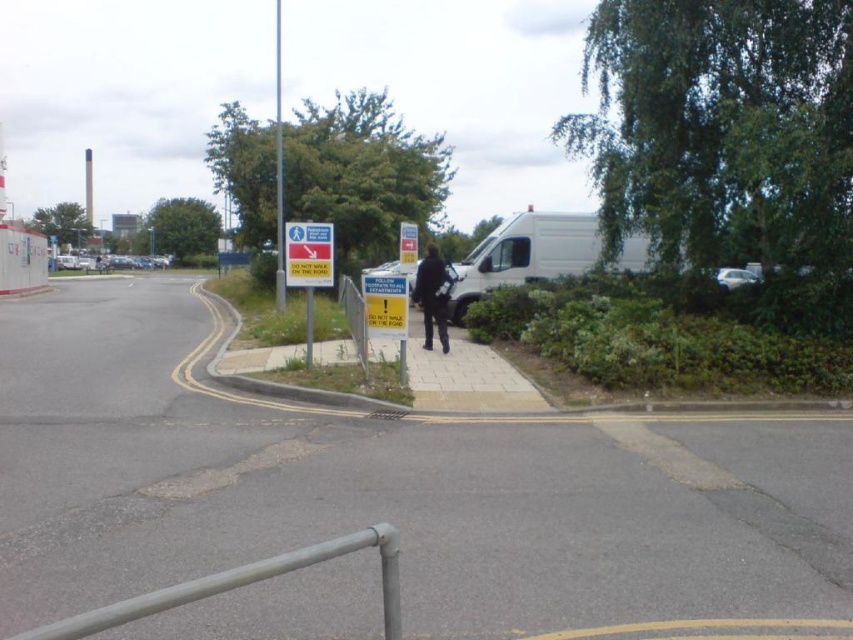
Question: Considering the real-world distances, which object is farthest from the dark blue jacket at center?

Choices:
 (A) metallic silver car at right
 (B) yellow plastic sign at center

Answer: (A)

Question: Among these objects, which one is farthest from the camera?

Choices:
 (A) yellow plastic sign at center
 (B) metallic silver car at right

Answer: (B)

Question: From the image, what is the correct spatial relationship of yellow plastic sign at center in relation to metallic silver car at right?

Choices:
 (A) below
 (B) above

Answer: (B)

Question: Can you confirm if blue plastic sign at center is positioned to the right of yellow plastic sign at center?

Choices:
 (A) no
 (B) yes

Answer: (B)

Question: Which object is positioned farthest from the yellow plastic sign at center?

Choices:
 (A) white plastic sign at center
 (B) metallic silver car at right
 (C) dark blue jacket at center

Answer: (B)

Question: Does dark blue jacket at center appear under metallic silver car at right?

Choices:
 (A) no
 (B) yes

Answer: (B)